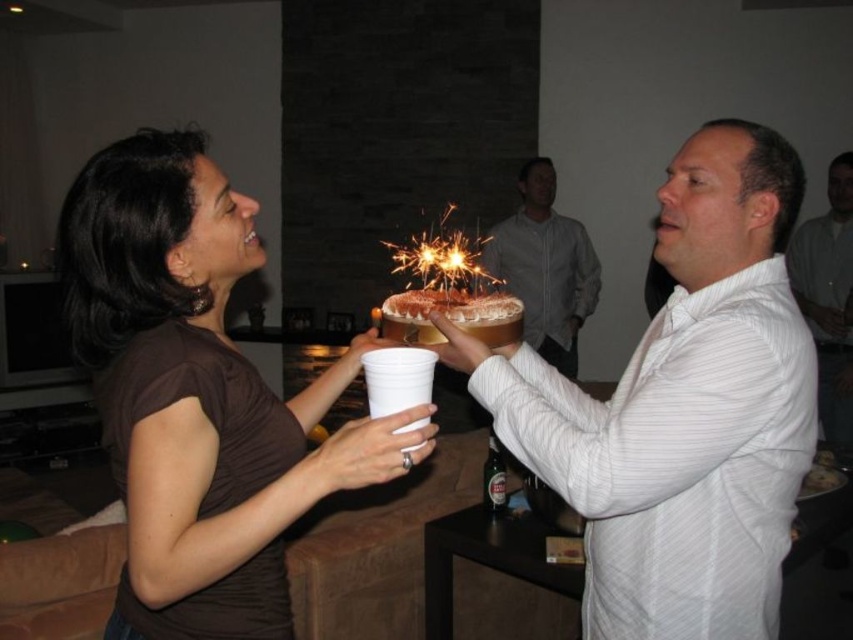
Can you confirm if brown matte shirt at upper left is positioned to the left of white striped shirt at right?

Yes, brown matte shirt at upper left is to the left of white striped shirt at right.

Based on the photo, can you confirm if brown matte shirt at upper left is bigger than white striped shirt at right?

Yes, brown matte shirt at upper left is bigger than white striped shirt at right.

Is point (177, 548) closer to camera compared to point (842, 154)?

Yes, it is.

You are a GUI agent. You are given a task and a screenshot of the screen. Output one action in this format:
    pyautogui.click(x=<x>, y=<y>)
    Task: Click on the brown matte shirt at upper left
    The height and width of the screenshot is (640, 853).
    Given the screenshot: What is the action you would take?
    pyautogui.click(x=199, y=396)

Can you confirm if white striped shirt at center is positioned to the right of brown matte shirt at upper left?

Correct, you'll find white striped shirt at center to the right of brown matte shirt at upper left.

Which is behind, point (653, 513) or point (195, 362)?

Point (653, 513)

Identify the location of white striped shirt at center. The image size is (853, 640). (682, 410).

Which is behind, point (819, 378) or point (448, 276)?

Point (448, 276)

This screenshot has width=853, height=640. Describe the element at coordinates (828, 296) in the screenshot. I see `white striped shirt at right` at that location.

Who is more distant from viewer, [837,260] or [444,241]?

The point [444,241] is more distant.

The height and width of the screenshot is (640, 853). In order to click on white striped shirt at right in this screenshot , I will do `click(828, 296)`.